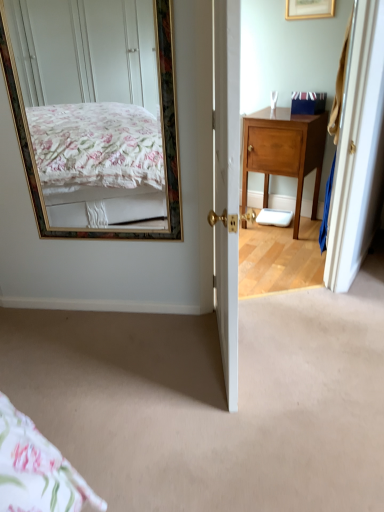
Find the location of a particular element. This screenshot has height=512, width=384. free area below gold-framed mirror at upper left (from a real-world perspective) is located at coordinates (121, 304).